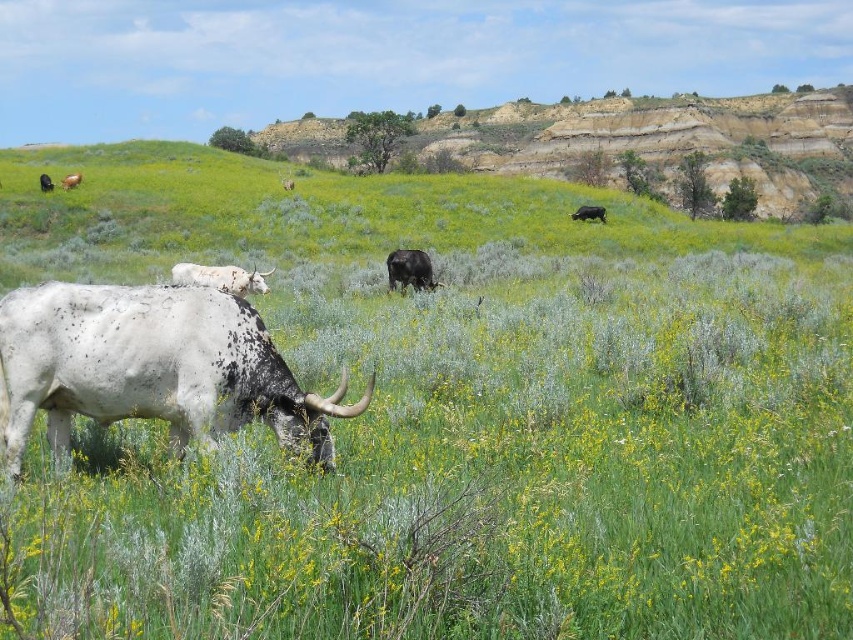
Looking at this image, you are standing at the point with coordinates point (x=51, y=182) and want to walk to the point with coordinates point (x=399, y=266). Is the destination point in front of or behind you?

The destination point (x=399, y=266) is in front of the starting point (x=51, y=182), so it is in front of you.

Consider the image. You are a farmer checking the field. You need to move the speckled white bull at lower left and the black matte bull at center to a pen that can only hold one bull at a time. Which bull should you move first to ensure the pen can accommodate the next one?

The speckled white bull at lower left might be wider than the black matte bull at center, so you should move the speckled white bull at lower left first to ensure the pen can accommodate the black matte bull at center afterward.

Looking at this image, you are a farmer who wants to separate the black matte bull at center from the dark brown cow at upper right. Based on their positions, which direction should you move the bull to ensure it is no longer to the left of the cow?

To ensure the black matte bull at center is no longer to the left of the dark brown cow at upper right, you should move the bull to the right side of the cow.